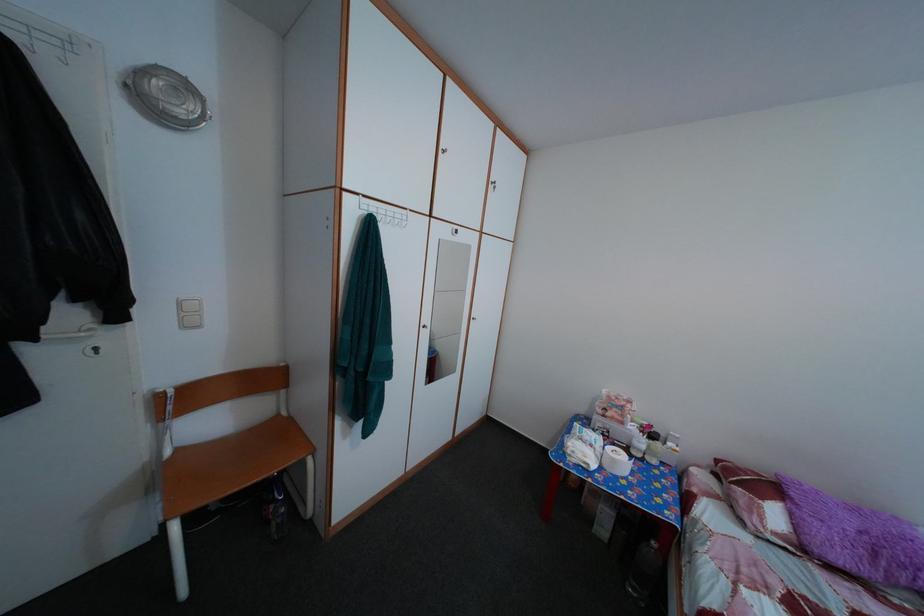
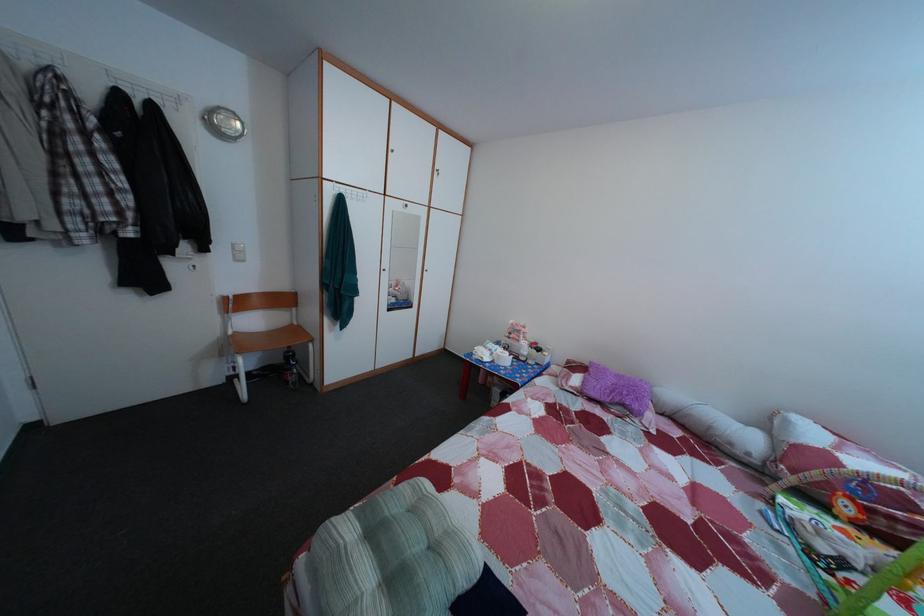
Find the pixel in the second image that matches point (188, 456) in the first image.

(245, 339)